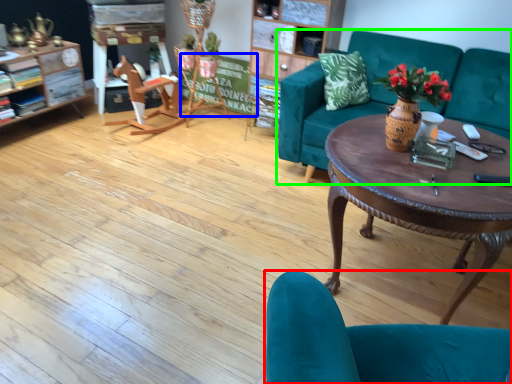
Question: Estimate the real-world distances between objects in this image. Which object is closer to chair (highlighted by a red box), bulletin board (highlighted by a blue box) or studio couch (highlighted by a green box)?

Choices:
 (A) bulletin board
 (B) studio couch

Answer: (B)